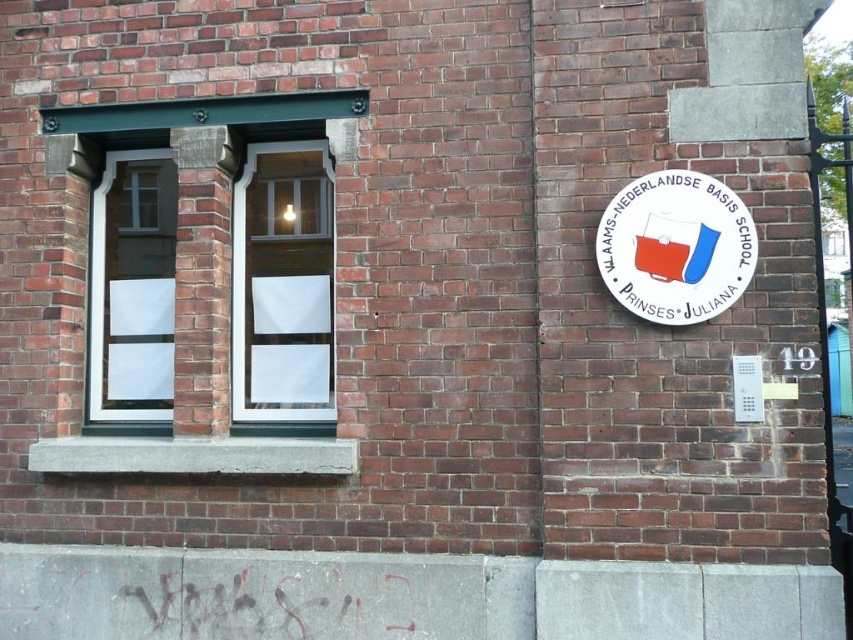
Question: Which of the following is the closest to the observer?

Choices:
 (A) white plastic sign at right
 (B) white glass window at center

Answer: (A)

Question: Can you confirm if white plastic sign at upper right is bigger than white plastic sign at right?

Choices:
 (A) no
 (B) yes

Answer: (B)

Question: Which of these objects is positioned farthest from the transparent glass door at left?

Choices:
 (A) white plastic sign at right
 (B) white plastic sign at upper right
 (C) white glass window at center

Answer: (A)

Question: Is transparent glass door at left below white plastic sign at upper right?

Choices:
 (A) no
 (B) yes

Answer: (B)

Question: Is transparent glass door at left smaller than white plastic sign at upper right?

Choices:
 (A) yes
 (B) no

Answer: (B)

Question: Based on their relative distances, which object is nearer to the white glass window at center?

Choices:
 (A) white plastic sign at right
 (B) white plastic sign at upper right
 (C) transparent glass door at left

Answer: (C)